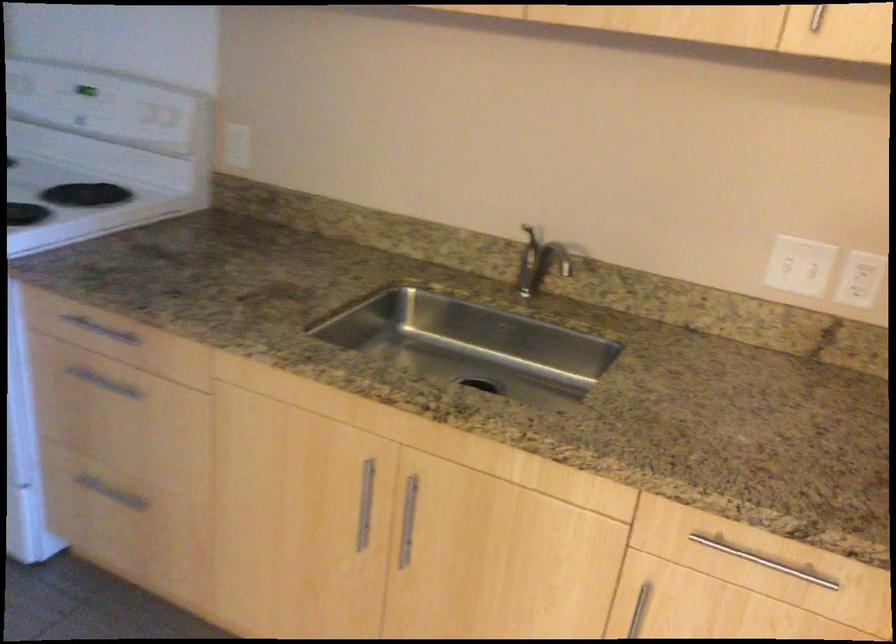
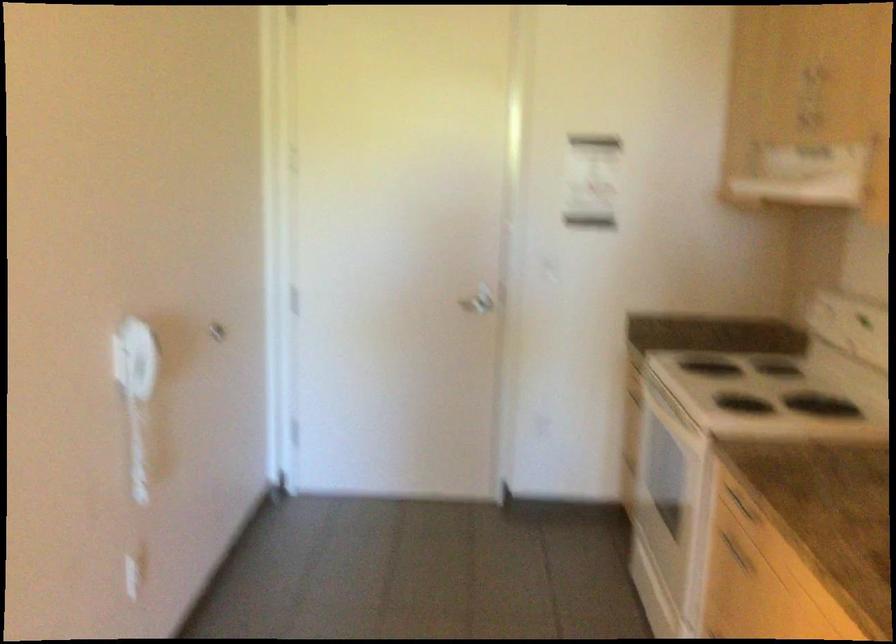
Question: The camera is either moving clockwise (left) or counter-clockwise (right) around the object. The first image is from the beginning of the video and the second image is from the end. Is the camera moving left or right when shooting the video?

Choices:
 (A) Left
 (B) Right

Answer: (B)